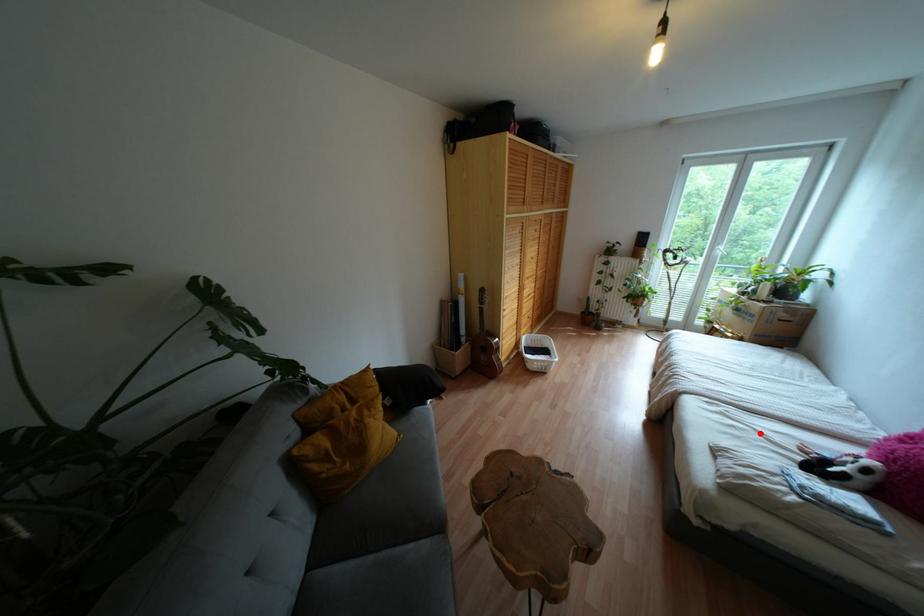
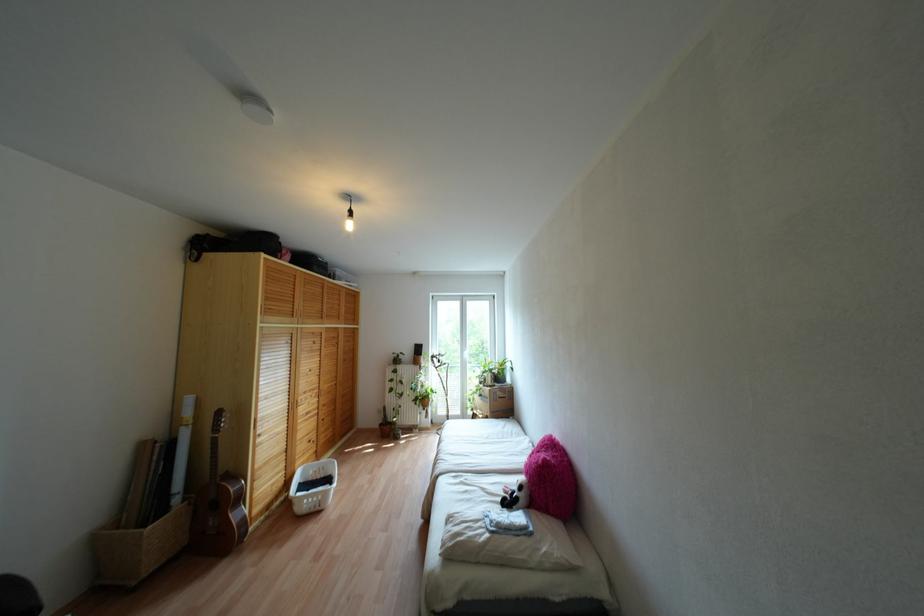
In the second image, find the point that corresponds to the highlighted location in the first image.

(482, 488)